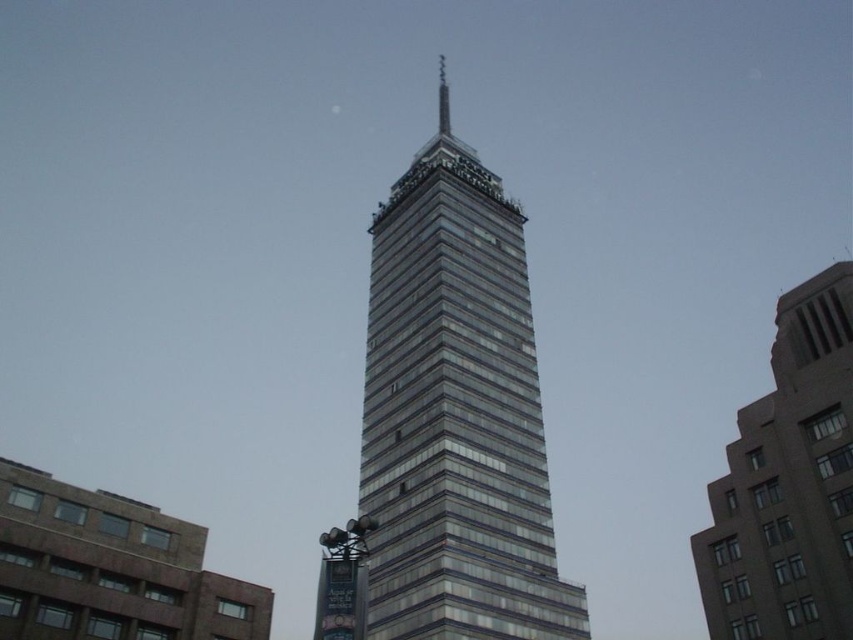
Question: Among these objects, which one is nearest to the camera?

Choices:
 (A) glassy steel tower at center
 (B) gray concrete building at right

Answer: (A)

Question: Does glassy steel tower at center come in front of gray concrete building at right?

Choices:
 (A) yes
 (B) no

Answer: (A)

Question: From the image, what is the correct spatial relationship of glassy steel tower at center in relation to gray concrete building at right?

Choices:
 (A) above
 (B) below

Answer: (A)

Question: Which of the following is the farthest from the observer?

Choices:
 (A) gray concrete building at right
 (B) glassy steel tower at center

Answer: (A)

Question: Can you confirm if glassy steel tower at center is positioned below gray concrete building at right?

Choices:
 (A) no
 (B) yes

Answer: (A)